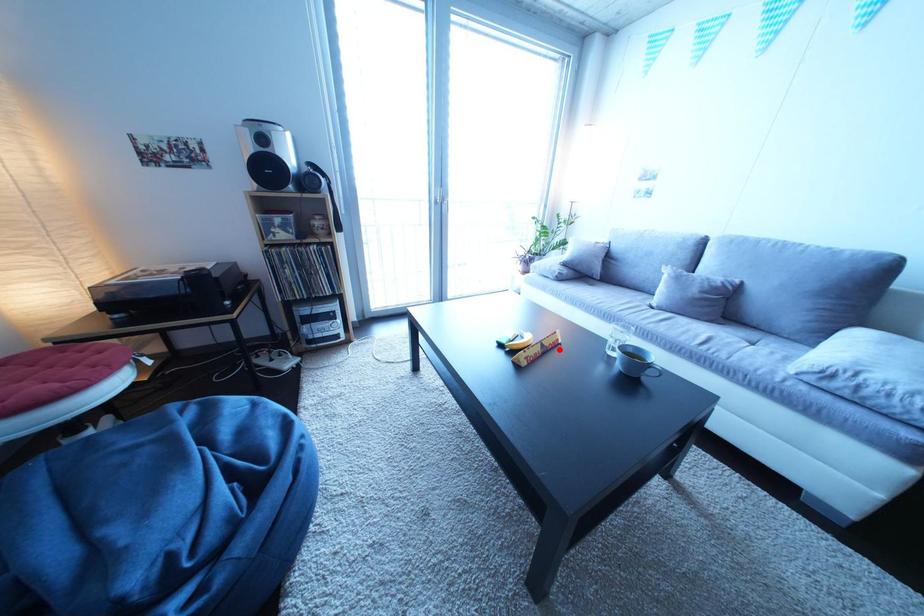
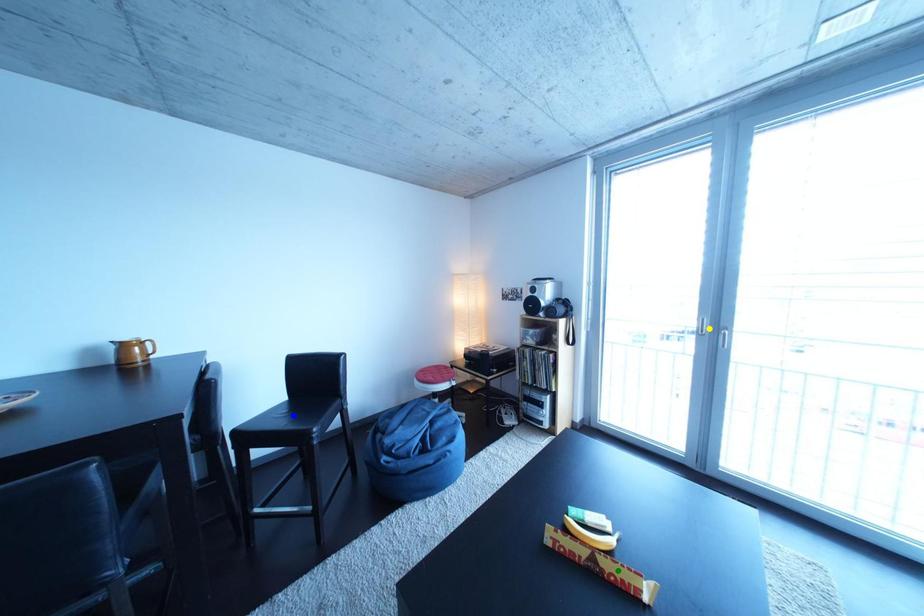
Question: I am providing you with two images of the same scene from different viewpoints. A red point is marked on the first image. You are given multiple points on the second image. In image 2, which mark is for the same physical point as the one in image 1?

Choices:
 (A) blue point
 (B) green point
 (C) yellow point

Answer: (B)